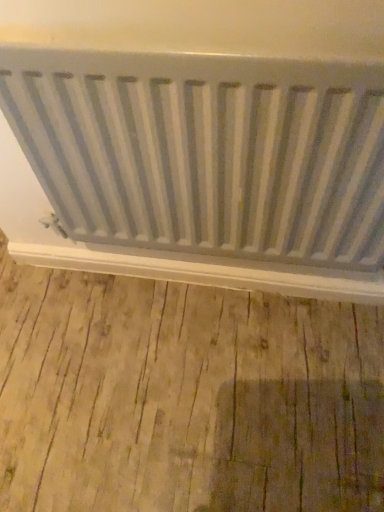
Identify the location of vacant point above white matte radiator at lower center (from a real-world perspective). (203, 266).